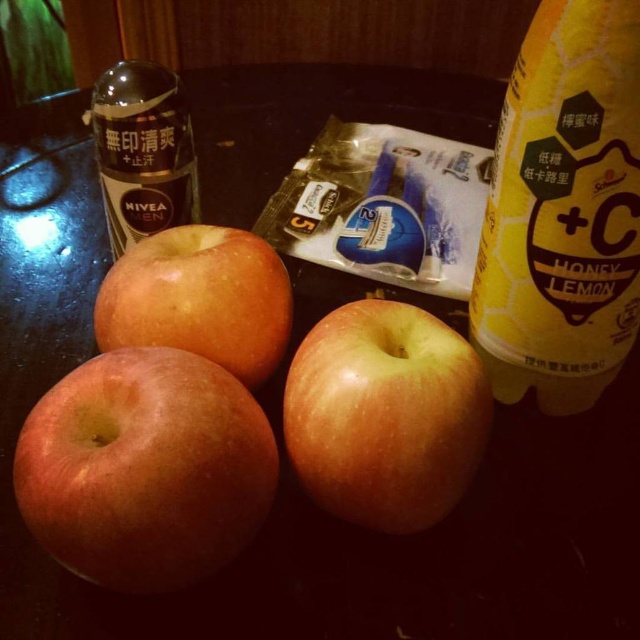
Is the position of yellow matte bottle at right more distant than that of yellow matte apple at center?

Yes, it is behind yellow matte apple at center.

Does yellow matte bottle at right appear on the right side of yellow matte apple at center?

Correct, you'll find yellow matte bottle at right to the right of yellow matte apple at center.

Is point (620, 308) farther from viewer compared to point (412, 396)?

Yes, it is.

Image resolution: width=640 pixels, height=640 pixels. What are the coordinates of `yellow matte bottle at right` in the screenshot? It's located at (563, 211).

Does yellow matte apple at center appear on the right side of shiny golden apple at center?

Indeed, yellow matte apple at center is positioned on the right side of shiny golden apple at center.

Can you confirm if yellow matte apple at center is taller than shiny golden apple at center?

Yes.

Who is more forward, [422,445] or [129,330]?

Point [422,445]

Where is `yellow matte apple at center`? yellow matte apple at center is located at coordinates (385, 413).

In the scene shown: Between shiny golden apple at center and matte plastic bottle at upper left, which one has less height?

With less height is shiny golden apple at center.

Locate an element on the screen. The width and height of the screenshot is (640, 640). shiny golden apple at center is located at coordinates (198, 298).